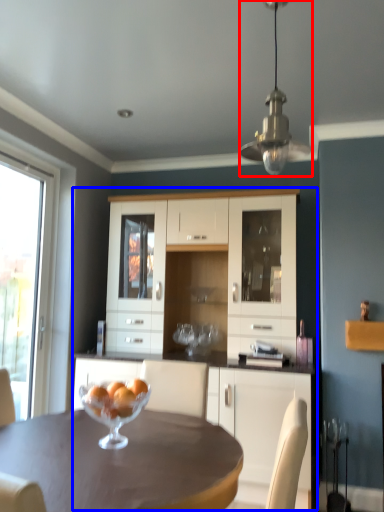
Question: Which object is further to the camera taking this photo, lamp (highlighted by a red box) or cupboard (highlighted by a blue box)?

Choices:
 (A) lamp
 (B) cupboard

Answer: (B)